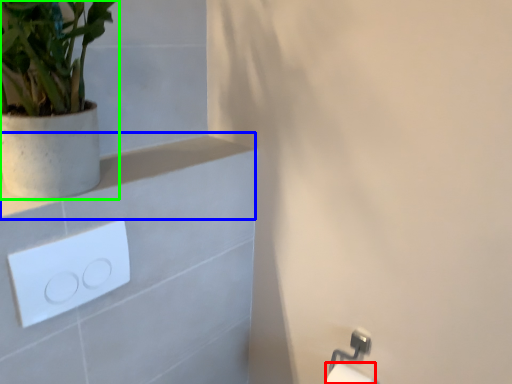
Question: Based on their relative distances, which object is nearer to toilet paper (highlighted by a red box)? Choose from balustrade (highlighted by a blue box) and houseplant (highlighted by a green box).

Choices:
 (A) balustrade
 (B) houseplant

Answer: (A)